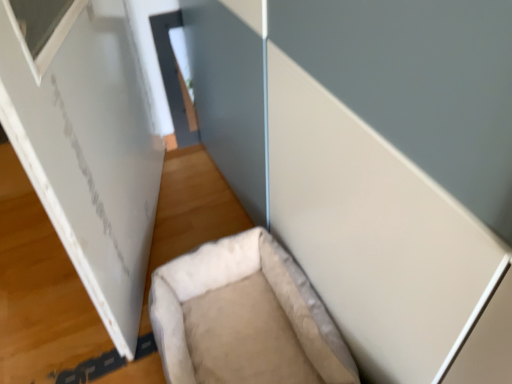
Where is `vacant space underneath white matte board at left (from a real-world perspective)`? This screenshot has width=512, height=384. vacant space underneath white matte board at left (from a real-world perspective) is located at coordinates (160, 214).